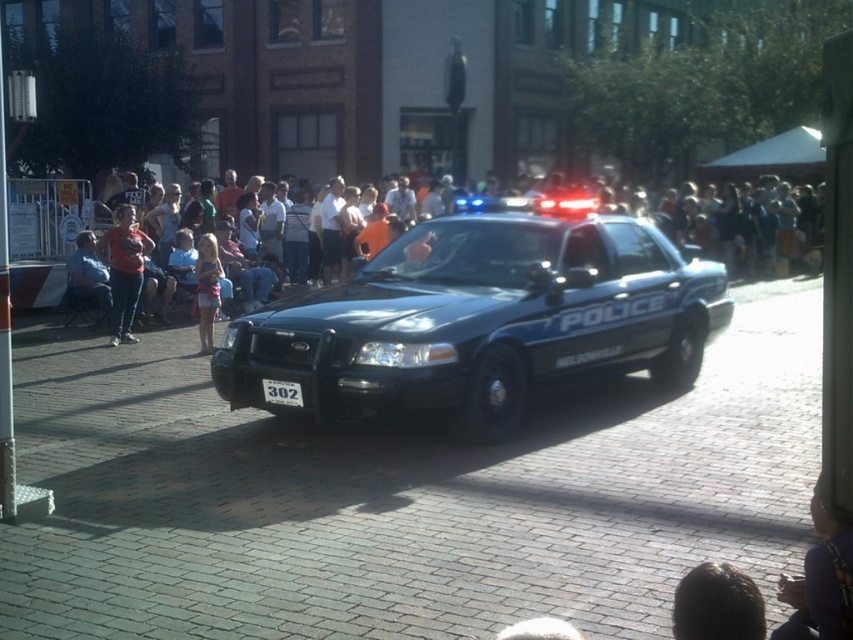
You are a photographer standing at the edge of the crowd, wanting to capture a clear shot of the police car. You notice two people in the way. One is wearing a white cotton shirt at center, and the other is wearing a matte red shirt at left. Which shirt should you focus on to ensure the police car is visible in your photo?

You should focus on the white cotton shirt at center because it is in front of the matte red shirt at left, blocking the view. Removing or moving the person in the white cotton shirt at center would allow a clearer view of the police car.

You are a photographer trying to capture a photo of the light pink fabric dress at center and the matte red shirt at left. Which clothing item appears wider in the photo?

The matte red shirt at left is wider than the light pink fabric dress at center, so it will appear wider in the photo.

You are a photographer trying to capture the glossy black police car at center and the matte red shirt at left in a single frame. Given their relative sizes in the image, which object will appear larger in your photo?

The glossy black police car at center will appear larger in the photo because its width surpasses that of the matte red shirt at left.